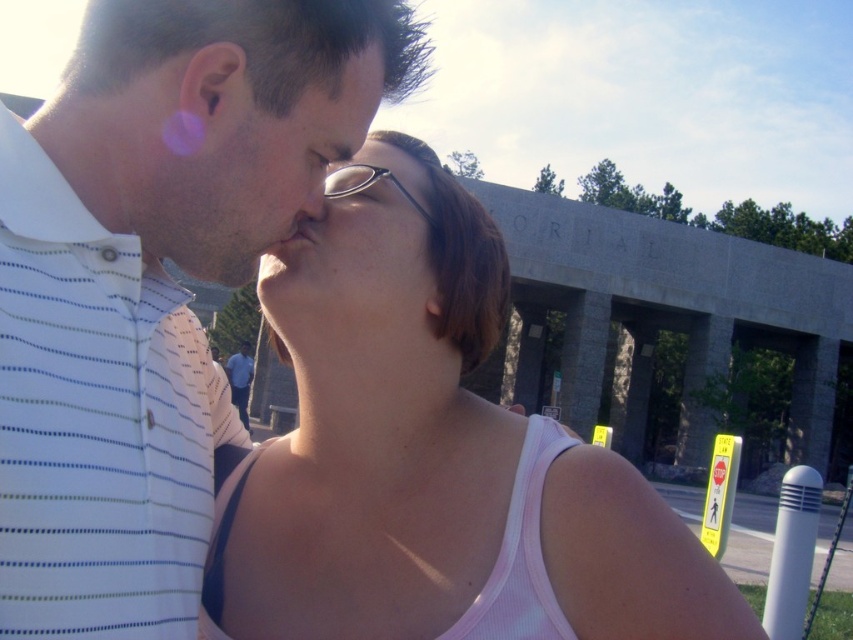
Describe the element at coordinates (434, 452) in the screenshot. I see `pink fabric tank top at center` at that location.

Is point (495, 324) more distant than point (270, 298)?

Yes, it is behind point (270, 298).

Find the location of a particular element. This screenshot has width=853, height=640. pink fabric tank top at center is located at coordinates (434, 452).

What are the coordinates of `pink fabric tank top at center` in the screenshot? It's located at pyautogui.click(x=434, y=452).

Is point (421, 168) farther from camera compared to point (312, 211)?

Yes, point (421, 168) is behind point (312, 211).

Between point (347, 173) and point (318, 208), which one is positioned behind?

Point (347, 173)

Is point (306, 248) farther from viewer compared to point (308, 208)?

Yes, it is.

In order to click on matte skin face at center in this screenshot , I will do click(355, 244).

Can you confirm if matte black glasses at center is wider than blue striped shirt at center?

In fact, matte black glasses at center might be narrower than blue striped shirt at center.

Does matte black glasses at center have a greater height compared to blue striped shirt at center?

Incorrect, matte black glasses at center's height is not larger of blue striped shirt at center's.

Is point (199, 256) positioned before point (242, 380)?

Yes, point (199, 256) is in front of point (242, 380).

Find the location of a particular element. This screenshot has width=853, height=640. matte black glasses at center is located at coordinates (260, 156).